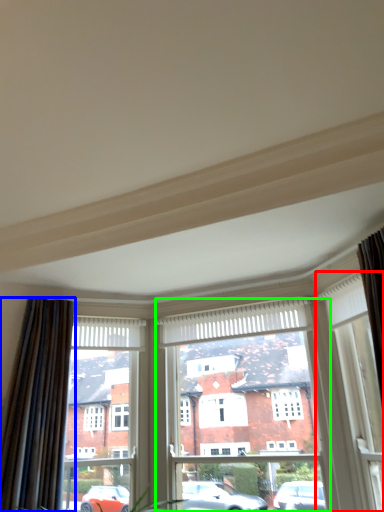
Question: Which object is the farthest from window (highlighted by a red box)? Choose among these: curtain (highlighted by a blue box) or window frame (highlighted by a green box).

Choices:
 (A) curtain
 (B) window frame

Answer: (A)